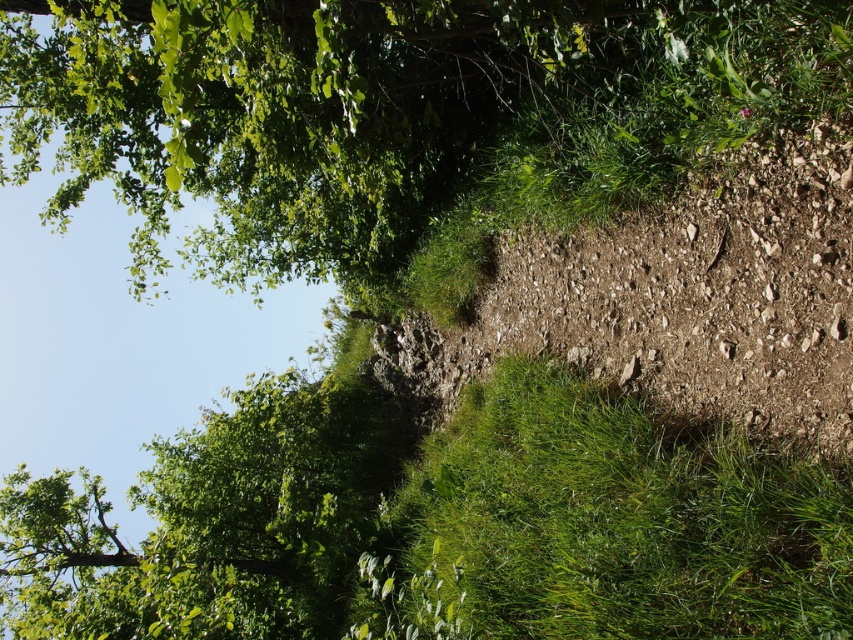
Question: Can you confirm if green leafy tree at upper left is positioned to the right of green grass at lower right?

Choices:
 (A) no
 (B) yes

Answer: (A)

Question: Among these objects, which one is nearest to the camera?

Choices:
 (A) green grass at lower right
 (B) green leafy tree at upper left

Answer: (A)

Question: Which object appears farthest from the camera in this image?

Choices:
 (A) green leafy tree at upper left
 (B) green grass at lower right

Answer: (A)

Question: Can you confirm if green leafy tree at upper left is positioned to the right of green grass at lower right?

Choices:
 (A) no
 (B) yes

Answer: (A)

Question: Is green leafy tree at upper left wider than green grass at lower right?

Choices:
 (A) yes
 (B) no

Answer: (B)

Question: Which point is closer to the camera?

Choices:
 (A) (682, 561)
 (B) (177, 141)

Answer: (B)